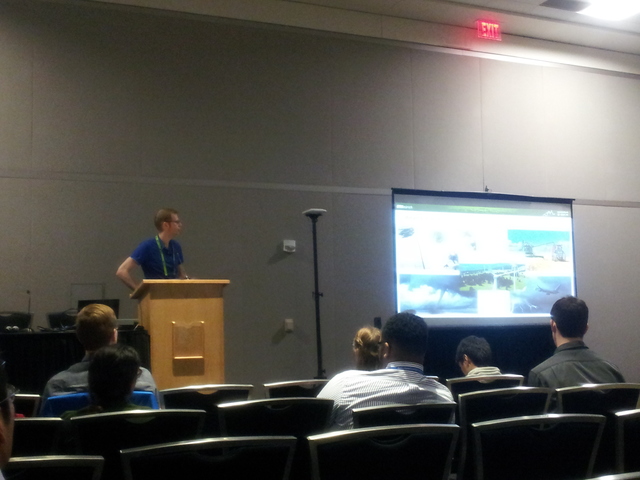
Where is `projector screen`? projector screen is located at coordinates (488, 224).